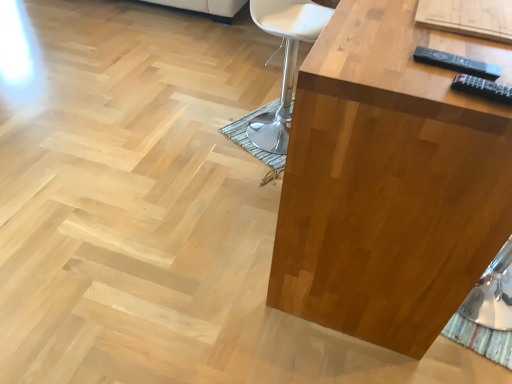
At what (x,y) coordinates should I click in order to perform the action: click on free space in front of black plastic remote at upper right, positioned as the second remote in bottom-to-top order. Please return your answer as a coordinate pair (x, y). Image resolution: width=512 pixels, height=384 pixels. Looking at the image, I should click on (454, 92).